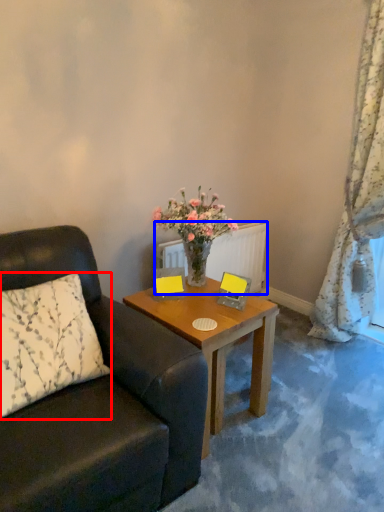
Question: Which object appears farthest to the camera in this image, pillow (highlighted by a red box) or radiator (highlighted by a blue box)?

Choices:
 (A) pillow
 (B) radiator

Answer: (B)